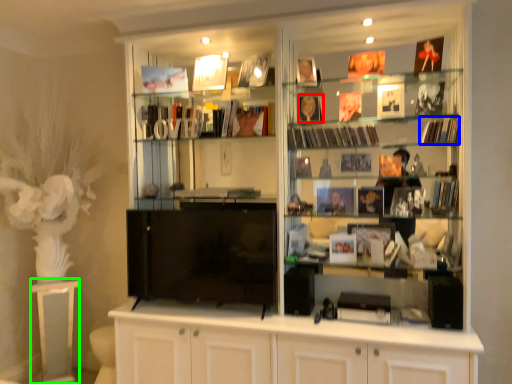
Question: Estimate the real-world distances between objects in this image. Which object is closer to book (highlighted by a red box), magazine (highlighted by a blue box) or table (highlighted by a green box)?

Choices:
 (A) magazine
 (B) table

Answer: (A)